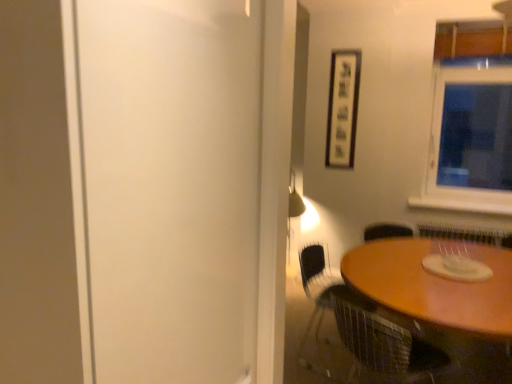
Question: Considering the relative positions of wooden table at lower right and white matte screen door at left in the image provided, is wooden table at lower right to the left of white matte screen door at left from the viewer's perspective?

Choices:
 (A) no
 (B) yes

Answer: (A)

Question: Can you confirm if wooden table at lower right is smaller than white matte screen door at left?

Choices:
 (A) no
 (B) yes

Answer: (A)

Question: Is wooden table at lower right wider than white matte screen door at left?

Choices:
 (A) yes
 (B) no

Answer: (A)

Question: Is wooden table at lower right further to the viewer compared to white matte screen door at left?

Choices:
 (A) no
 (B) yes

Answer: (B)

Question: Are wooden table at lower right and white matte screen door at left far apart?

Choices:
 (A) yes
 (B) no

Answer: (A)

Question: From a real-world perspective, is wooden table at lower right on top of white matte screen door at left?

Choices:
 (A) no
 (B) yes

Answer: (A)

Question: Is metal mesh chair at lower right positioned with its back to white matte screen door at left?

Choices:
 (A) yes
 (B) no

Answer: (B)

Question: Does metal mesh chair at lower right have a greater width compared to white matte screen door at left?

Choices:
 (A) no
 (B) yes

Answer: (A)

Question: Is the position of metal mesh chair at lower right less distant than that of white matte screen door at left?

Choices:
 (A) no
 (B) yes

Answer: (A)

Question: Is metal mesh chair at lower right outside white matte screen door at left?

Choices:
 (A) no
 (B) yes

Answer: (B)

Question: Is metal mesh chair at lower right taller than white matte screen door at left?

Choices:
 (A) no
 (B) yes

Answer: (A)

Question: Can you confirm if metal mesh chair at lower right is thinner than white matte screen door at left?

Choices:
 (A) no
 (B) yes

Answer: (B)

Question: Would you say metal mesh chair at lower right is outside wooden table at lower right?

Choices:
 (A) yes
 (B) no

Answer: (B)